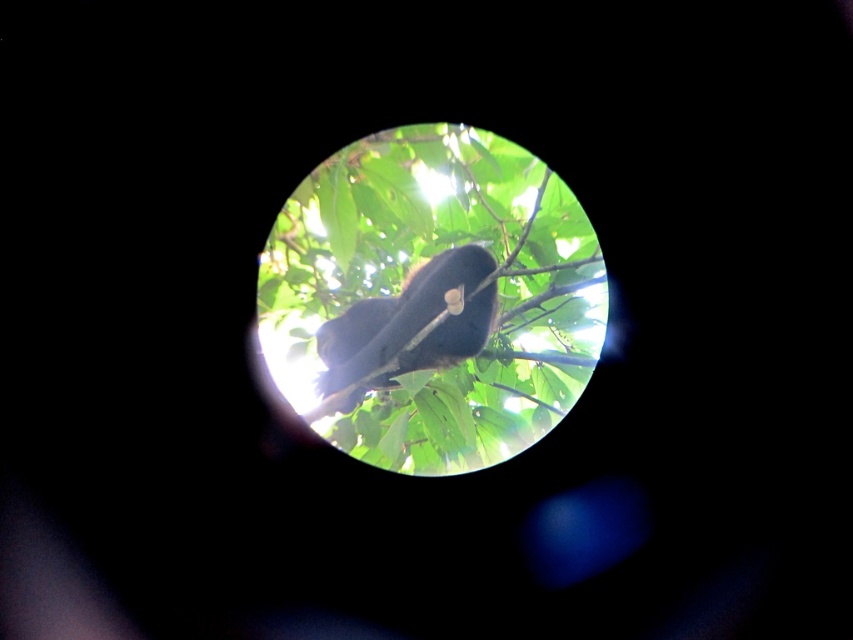
You are a hiker trying to spot the shiny black monkey at center in a dense green leafy tree at center. Based on their positions, which object is higher up in the tree?

The green leafy tree at center is positioned over the shiny black monkey at center, meaning the monkey is lower down in the tree.